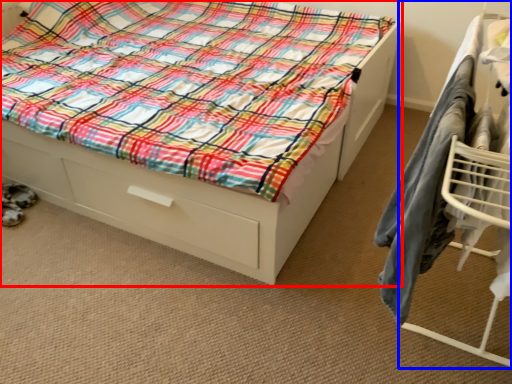
Question: Which object is further to the camera taking this photo, bed (highlighted by a red box) or furniture (highlighted by a blue box)?

Choices:
 (A) bed
 (B) furniture

Answer: (A)